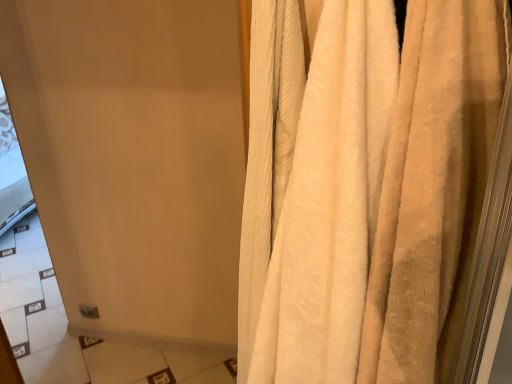
Question: Is beige textured curtain at right oriented away from matte white screen door at upper left?

Choices:
 (A) no
 (B) yes

Answer: (A)

Question: Are beige textured curtain at right and matte white screen door at upper left far apart?

Choices:
 (A) no
 (B) yes

Answer: (B)

Question: From the image's perspective, does beige textured curtain at right appear higher than matte white screen door at upper left?

Choices:
 (A) no
 (B) yes

Answer: (B)

Question: Would you say beige textured curtain at right is outside matte white screen door at upper left?

Choices:
 (A) yes
 (B) no

Answer: (A)

Question: Is beige textured curtain at right thinner than matte white screen door at upper left?

Choices:
 (A) yes
 (B) no

Answer: (B)

Question: Is beige textured curtain at right at the right side of matte white screen door at upper left?

Choices:
 (A) no
 (B) yes

Answer: (B)

Question: Can you confirm if matte white screen door at upper left is shorter than beige textured curtain at right?

Choices:
 (A) yes
 (B) no

Answer: (B)

Question: Is matte white screen door at upper left surrounding beige textured curtain at right?

Choices:
 (A) no
 (B) yes

Answer: (A)

Question: Does matte white screen door at upper left have a greater width compared to beige textured curtain at right?

Choices:
 (A) yes
 (B) no

Answer: (B)

Question: Is matte white screen door at upper left oriented away from beige textured curtain at right?

Choices:
 (A) no
 (B) yes

Answer: (A)

Question: Is matte white screen door at upper left at the left side of beige textured curtain at right?

Choices:
 (A) no
 (B) yes

Answer: (B)

Question: From a real-world perspective, is matte white screen door at upper left beneath beige textured curtain at right?

Choices:
 (A) yes
 (B) no

Answer: (A)

Question: Do you think matte white screen door at upper left is within beige textured curtain at right, or outside of it?

Choices:
 (A) inside
 (B) outside

Answer: (B)